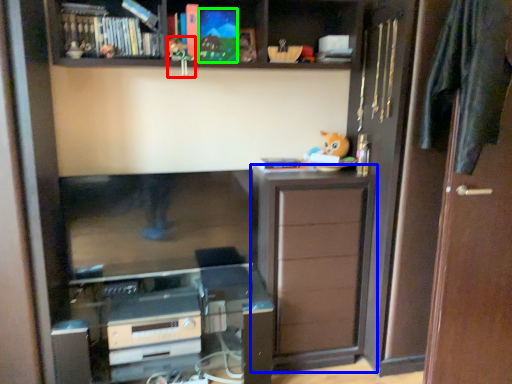
Question: Which object is positioned farthest from toy (highlighted by a red box)? Select from cabinetry (highlighted by a blue box) and book (highlighted by a green box).

Choices:
 (A) cabinetry
 (B) book

Answer: (A)